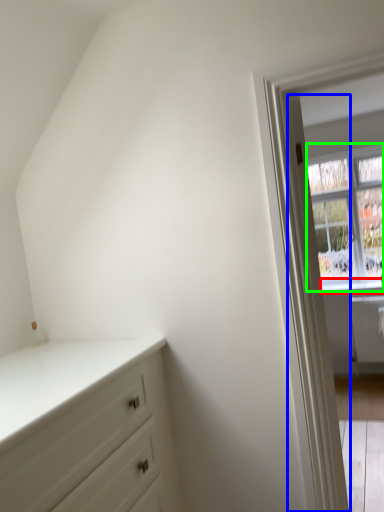
Question: Which object is positioned closest to window sill (highlighted by a red box)? Select from door (highlighted by a blue box) and window (highlighted by a green box).

Choices:
 (A) door
 (B) window

Answer: (B)